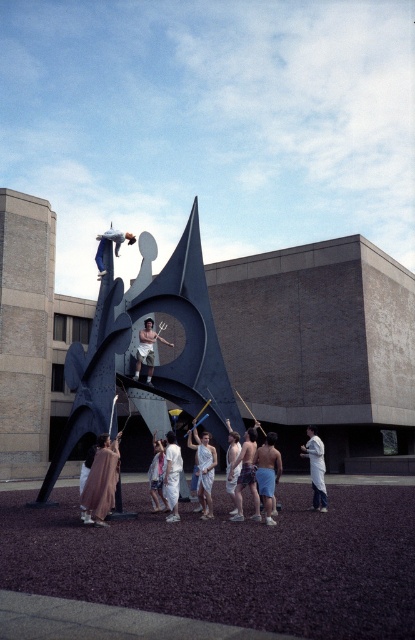
Find the location of a particular element. Image resolution: width=415 pixels, height=640 pixels. matte brown robe at lower left is located at coordinates (100, 481).

Can you confirm if matte brown robe at lower left is positioned to the right of white lab coat at center?

In fact, matte brown robe at lower left is to the left of white lab coat at center.

Find the location of `matte brown robe at lower left`. matte brown robe at lower left is located at coordinates (100, 481).

Is point (261, 486) in front of point (161, 337)?

Yes, point (261, 486) is closer to viewer.

Which is more to the right, blue shorts at center or matte black trident at center?

Positioned to the right is blue shorts at center.

The height and width of the screenshot is (640, 415). Find the location of `blue shorts at center`. blue shorts at center is located at coordinates (268, 472).

Does polished steel sculpture at center have a greater width compared to white lab coat at center?

Indeed, polished steel sculpture at center has a greater width compared to white lab coat at center.

Looking at this image, can you confirm if polished steel sculpture at center is positioned to the left of white lab coat at center?

Correct, you'll find polished steel sculpture at center to the left of white lab coat at center.

Does point (95, 404) come closer to viewer compared to point (319, 486)?

No, (95, 404) is behind (319, 486).

You are a GUI agent. You are given a task and a screenshot of the screen. Output one action in this format:
    pyautogui.click(x=<x>, y=<y>)
    Task: Click on the polished steel sculpture at center
    The height and width of the screenshot is (640, 415).
    Given the screenshot: What is the action you would take?
    [x=129, y=340]